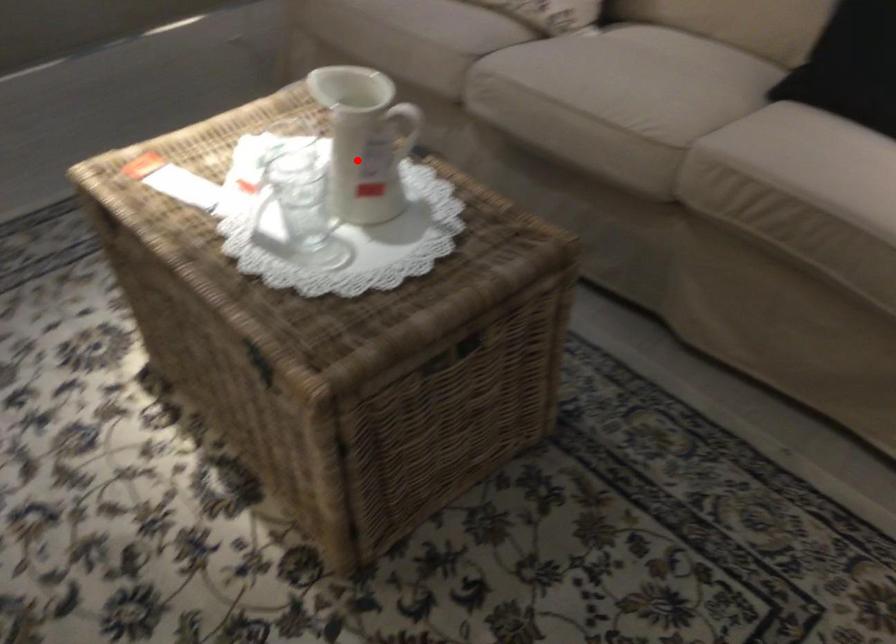
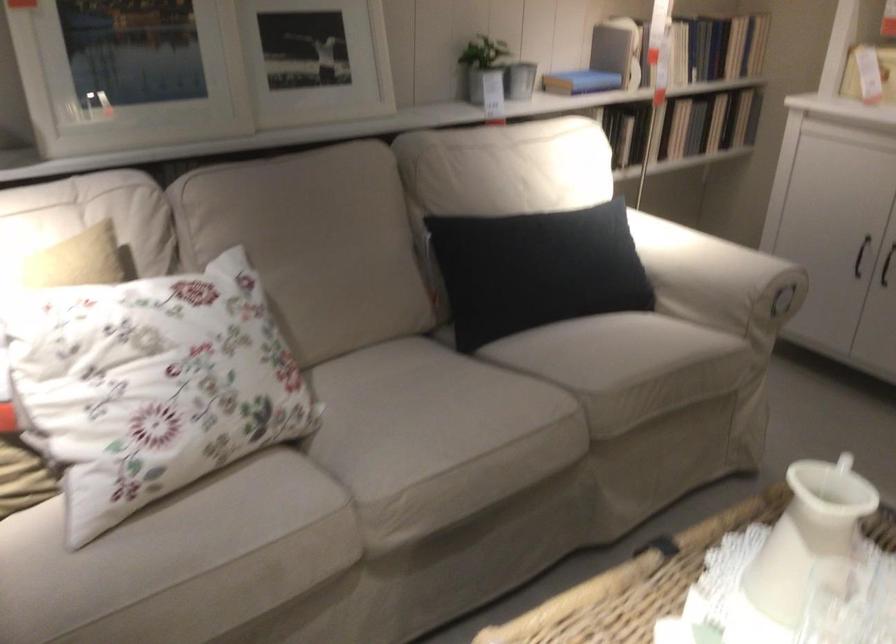
Question: I am providing you with two images of the same scene from different viewpoints. In image1, a red point is highlighted. Considering the same 3D point in image2, which of the following is correct?

Choices:
 (A) It is closer
 (B) It is farther

Answer: (A)